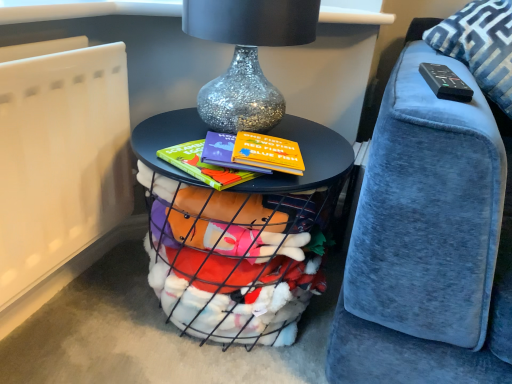
Question: Does metallic wire basket at center appear on the right side of white matte radiator at lower left?

Choices:
 (A) no
 (B) yes

Answer: (B)

Question: Can you confirm if metallic wire basket at center is smaller than white matte radiator at lower left?

Choices:
 (A) yes
 (B) no

Answer: (B)

Question: Considering the relative positions of metallic wire basket at center and white matte radiator at lower left in the image provided, is metallic wire basket at center to the left of white matte radiator at lower left from the viewer's perspective?

Choices:
 (A) yes
 (B) no

Answer: (B)

Question: Is metallic wire basket at center facing away from white matte radiator at lower left?

Choices:
 (A) yes
 (B) no

Answer: (B)

Question: From the image's perspective, is metallic wire basket at center under white matte radiator at lower left?

Choices:
 (A) yes
 (B) no

Answer: (A)

Question: Considering the relative sizes of metallic wire basket at center and white matte radiator at lower left in the image provided, is metallic wire basket at center shorter than white matte radiator at lower left?

Choices:
 (A) yes
 (B) no

Answer: (A)

Question: Does glittery silver glass table lamp at center have a lesser height compared to black plastic remote at upper right?

Choices:
 (A) yes
 (B) no

Answer: (B)

Question: Does glittery silver glass table lamp at center come behind black plastic remote at upper right?

Choices:
 (A) no
 (B) yes

Answer: (B)

Question: Is glittery silver glass table lamp at center positioned far away from black plastic remote at upper right?

Choices:
 (A) no
 (B) yes

Answer: (A)

Question: Considering the relative sizes of glittery silver glass table lamp at center and black plastic remote at upper right in the image provided, is glittery silver glass table lamp at center bigger than black plastic remote at upper right?

Choices:
 (A) yes
 (B) no

Answer: (A)

Question: Is glittery silver glass table lamp at center surrounding black plastic remote at upper right?

Choices:
 (A) no
 (B) yes

Answer: (A)

Question: Can you confirm if glittery silver glass table lamp at center is thinner than black plastic remote at upper right?

Choices:
 (A) no
 (B) yes

Answer: (A)

Question: From the image's perspective, is blue velvet pillow at upper right below metallic wire basket at center?

Choices:
 (A) yes
 (B) no

Answer: (B)